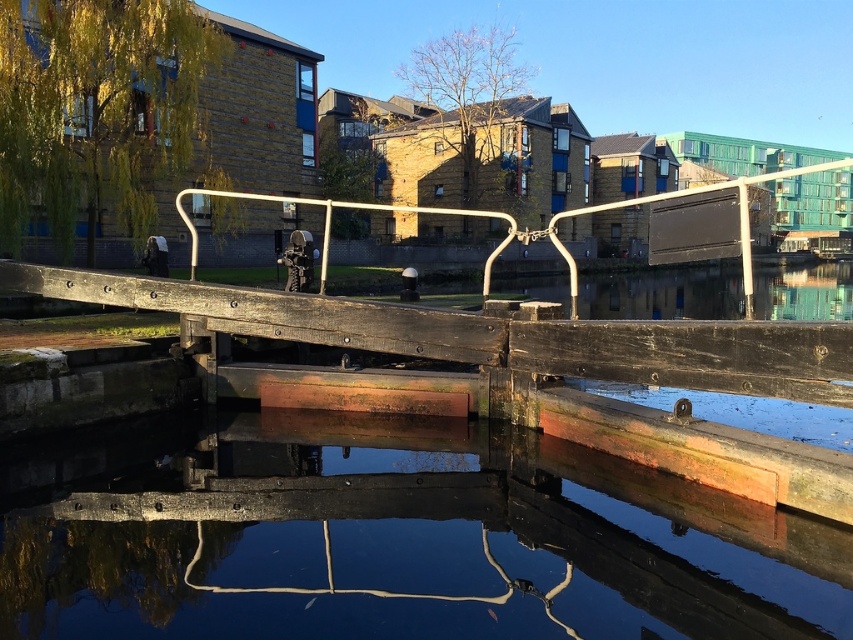
You are standing on the wooden bridge and looking down at the water and rail. Which object is closer to you, the smooth concrete water at center or the white metal rail at center?

The smooth concrete water at center is closer to the viewer than the white metal rail at center.

You are an architect designing a new riverside walkway and need to ensure safety for visitors. The smooth concrete water at center and the white metal rail at center are both in your design plan. Since the water is thinner than the rail, which one should you prioritize reinforcing to prevent accidents?

The smooth concrete water at center is thinner than the white metal rail at center, so you should prioritize reinforcing the smooth concrete water at center to prevent accidents.

You are standing on the wooden bridge and want to see the smooth concrete water at center. Which direction should you look relative to the white metal rail at center?

You should look downward toward the smooth concrete water at center since it is located below the white metal rail at center.